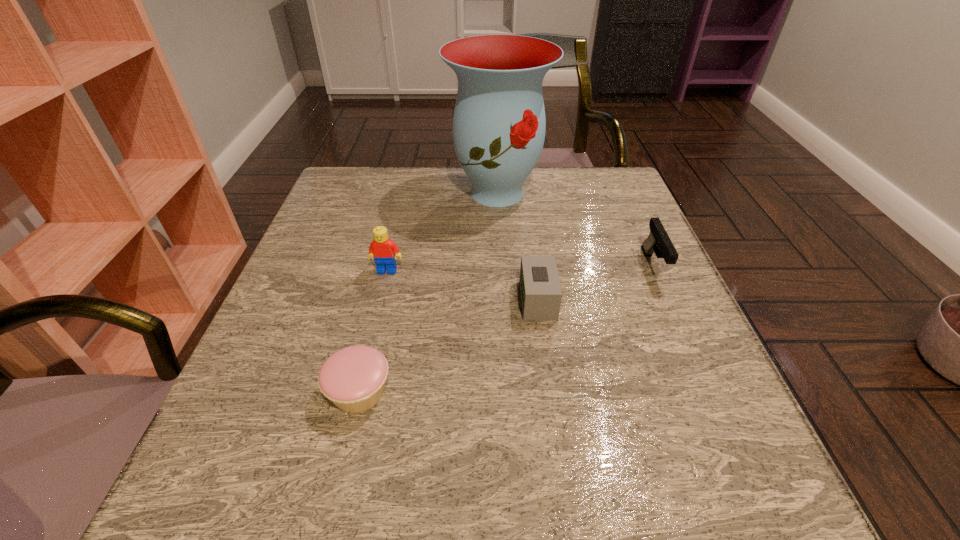
I want to click on vacant space in between the third shortest object and the alarm clock, so click(x=595, y=284).

Find the location of a particular element. empty space between the third tallest object and the tallest object is located at coordinates pyautogui.click(x=575, y=230).

I want to click on free space between the nearest object and the tallest object, so click(428, 293).

Locate an element on the screen. free spot between the alarm clock and the Lego is located at coordinates (463, 286).

Locate an element on the screen. This screenshot has width=960, height=540. free space that is in between the alarm clock and the cupcake is located at coordinates (449, 346).

Identify which object is located as the third nearest to the tallest object. Please provide its 2D coordinates. Your answer should be formatted as a tuple, i.e. [(x, y)], where the tuple contains the x and y coordinates of a point satisfying the conditions above.

[(541, 294)]

This screenshot has width=960, height=540. Identify the location of object that stands as the closest to the farthest object. (384, 251).

Locate an element on the screen. This screenshot has width=960, height=540. vacant area that satisfies the following two spatial constraints: 1. on the front-facing side of the rightmost object; 2. on the front-facing side of the alarm clock is located at coordinates (667, 300).

You are a GUI agent. You are given a task and a screenshot of the screen. Output one action in this format:
    pyautogui.click(x=<x>, y=<y>)
    Task: Click on the vacant region that satisfies the following two spatial constraints: 1. on the front-facing side of the rightmost object; 2. on the front-facing side of the alarm clock
    
    Given the screenshot: What is the action you would take?
    pyautogui.click(x=667, y=300)

Locate an element on the screen. The image size is (960, 540). free space that satisfies the following two spatial constraints: 1. on the face of the second tallest object; 2. on the right side of the cupcake is located at coordinates (358, 392).